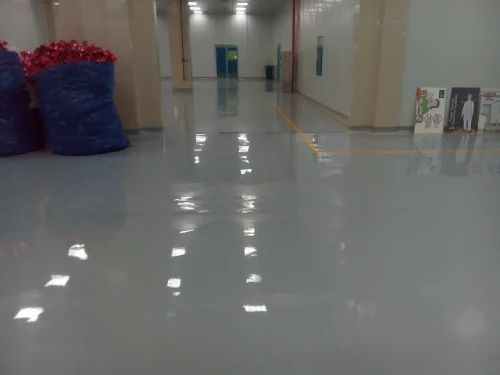
Locate an element on the screen. floor is located at coordinates (240, 84), (283, 166), (190, 243).